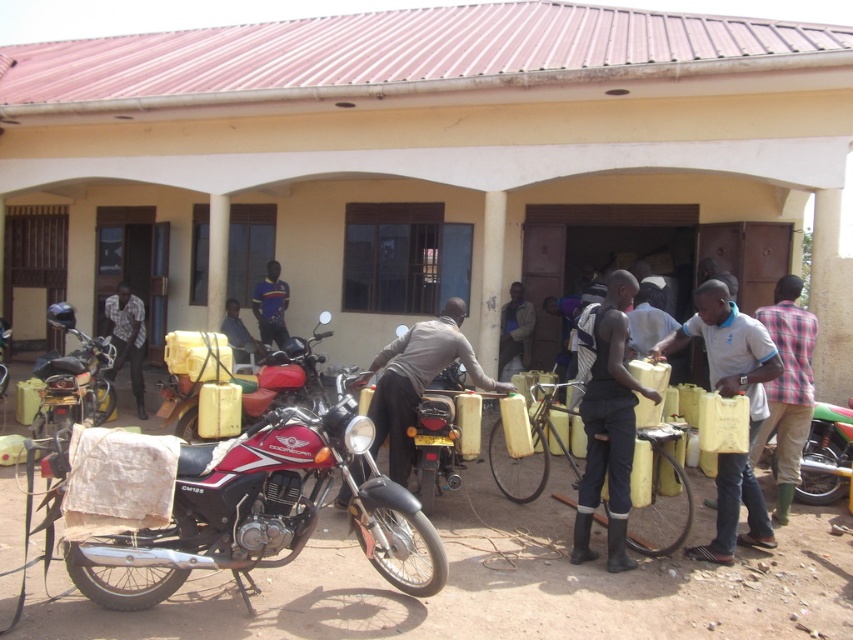
You are standing at the entrance of the building with the red corrugated metal roof. You need to walk to the point marked at coordinates (498,387). How far will you have to walk in meters?

The point at coordinates (498,387) is 6.08 meters away from the viewer, so you will have to walk 6.08 meters to reach it.

You are standing in front of the building with the red corrugated metal roof and cream walls. You notice two points marked in the scene. Which point is closer to you, point (625, 525) or point (393, 420)?

Point (625, 525) is closer to the viewer than point (393, 420).